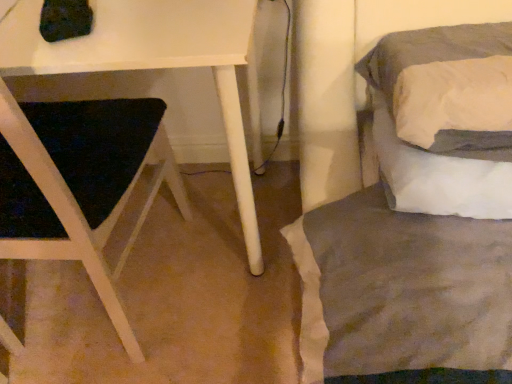
Question: Can you confirm if white matte table at left is positioned to the left of gray fabric bed at right?

Choices:
 (A) yes
 (B) no

Answer: (A)

Question: Does white matte table at left have a greater height compared to gray fabric bed at right?

Choices:
 (A) no
 (B) yes

Answer: (B)

Question: Is white matte table at left shorter than gray fabric bed at right?

Choices:
 (A) yes
 (B) no

Answer: (B)

Question: Are white matte table at left and gray fabric bed at right far apart?

Choices:
 (A) yes
 (B) no

Answer: (B)

Question: Does white matte table at left come behind gray fabric bed at right?

Choices:
 (A) no
 (B) yes

Answer: (B)

Question: From the image's perspective, is white matte table at left on top of gray fabric bed at right?

Choices:
 (A) no
 (B) yes

Answer: (A)

Question: From a real-world perspective, is gray fabric bed at right on top of white matte table at left?

Choices:
 (A) yes
 (B) no

Answer: (A)

Question: From the image's perspective, would you say gray fabric bed at right is shown under white matte table at left?

Choices:
 (A) yes
 (B) no

Answer: (B)

Question: Is gray fabric bed at right not inside white matte table at left?

Choices:
 (A) no
 (B) yes

Answer: (B)

Question: Are gray fabric bed at right and white matte table at left far apart?

Choices:
 (A) no
 (B) yes

Answer: (A)

Question: Is gray fabric bed at right at the right side of white matte table at left?

Choices:
 (A) yes
 (B) no

Answer: (A)

Question: Is gray fabric bed at right taller than white matte table at left?

Choices:
 (A) yes
 (B) no

Answer: (B)

Question: From a real-world perspective, relative to gray fabric bed at right, is white matte table at left vertically above or below?

Choices:
 (A) below
 (B) above

Answer: (A)